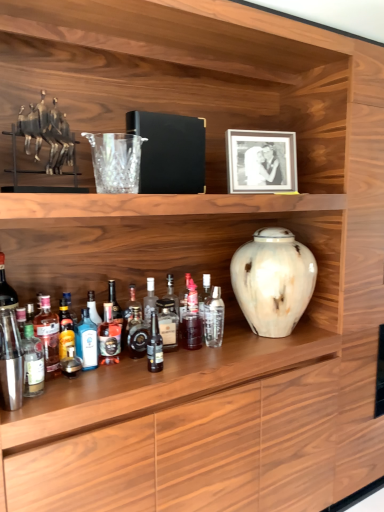
Measure the distance between point (55, 327) and camera.

A distance of 5.23 feet exists between point (55, 327) and camera.

What do you see at coordinates (33, 362) in the screenshot?
I see `translucent glass bottle at lower left, which is the ninth bottle from right to left` at bounding box center [33, 362].

What is the approximate height of translucent glass bottle at lower left, marked as the second bottle in a left-to-right arrangement?

translucent glass bottle at lower left, marked as the second bottle in a left-to-right arrangement, is 10.23 inches in height.

What do you see at coordinates (192, 320) in the screenshot? This screenshot has width=384, height=512. I see `translucent glass bottle at center, the 2th bottle positioned from the right` at bounding box center [192, 320].

Locate an element on the screen. Image resolution: width=384 pixels, height=512 pixels. clear glass bottle at center, the 10th bottle when ordered from left to right is located at coordinates (214, 318).

What do you see at coordinates (11, 361) in the screenshot?
I see `shiny metallic shaker at left, which appears as the 1th bottle when viewed from the left` at bounding box center [11, 361].

Locate an element on the screen. The image size is (384, 512). translucent glass bottle at lower left, marked as the eighth bottle in a right-to-left arrangement is located at coordinates 48,334.

Is translucent glass bottle at center, the 3th bottle in the right-to-left sequence, positioned with its back to blue glass bottle at center, which is counted as the seventh bottle, starting from the right?

No, translucent glass bottle at center, the 3th bottle in the right-to-left sequence, is not facing away from blue glass bottle at center, which is counted as the seventh bottle, starting from the right.

Is translucent glass bottle at center, the 3th bottle in the right-to-left sequence, inside the boundaries of blue glass bottle at center, which is counted as the 4th bottle, starting from the left, or outside?

translucent glass bottle at center, the 3th bottle in the right-to-left sequence, cannot be found inside blue glass bottle at center, which is counted as the 4th bottle, starting from the left.

Considering the relative sizes of translucent glass bottle at center, the 3th bottle in the right-to-left sequence, and blue glass bottle at center, which is counted as the 4th bottle, starting from the left, in the image provided, is translucent glass bottle at center, the 3th bottle in the right-to-left sequence, wider than blue glass bottle at center, which is counted as the 4th bottle, starting from the left,?

Incorrect, the width of translucent glass bottle at center, the 3th bottle in the right-to-left sequence, does not surpass that of blue glass bottle at center, which is counted as the 4th bottle, starting from the left.

How far apart are translucent glass bottle at center, which appears as the 9th bottle when viewed from the left, and blue glass bottle at center, the fifth bottle from the left?

translucent glass bottle at center, which appears as the 9th bottle when viewed from the left, is 13.58 inches away from blue glass bottle at center, the fifth bottle from the left.

Is point (183, 317) closer to viewer compared to point (113, 357)?

No, it is not.

Would you say translucent glass bottle at center, the 2th bottle positioned from the right, is outside blue glass bottle at center, the fifth bottle from the left?

Yes, translucent glass bottle at center, the 2th bottle positioned from the right, is located beyond the bounds of blue glass bottle at center, the fifth bottle from the left.

Where is `the 5th bottle below the translucent glass bottle at center, the 2th bottle positioned from the right (from the image's perspective)`? the 5th bottle below the translucent glass bottle at center, the 2th bottle positioned from the right (from the image's perspective) is located at coordinates (109, 337).

Is translucent glass bottle at lower left, which is the ninth bottle from right to left, closer to camera compared to shiny metallic shaker at left, positioned as the 10th bottle in right-to-left order?

No, translucent glass bottle at lower left, which is the ninth bottle from right to left, is behind shiny metallic shaker at left, positioned as the 10th bottle in right-to-left order.

Does point (24, 345) come behind point (5, 326)?

That is True.

Can you confirm if translucent glass bottle at lower left, which is the ninth bottle from right to left, is positioned to the left of shiny metallic shaker at left, which appears as the 1th bottle when viewed from the left?

In fact, translucent glass bottle at lower left, which is the ninth bottle from right to left, is to the right of shiny metallic shaker at left, which appears as the 1th bottle when viewed from the left.

Considering the sizes of objects translucent glass bottle at lower left, marked as the second bottle in a left-to-right arrangement, and shiny metallic shaker at left, which appears as the 1th bottle when viewed from the left, in the image provided, who is taller, translucent glass bottle at lower left, marked as the second bottle in a left-to-right arrangement, or shiny metallic shaker at left, which appears as the 1th bottle when viewed from the left,?

shiny metallic shaker at left, which appears as the 1th bottle when viewed from the left.

From a real-world perspective, is clear glass bottle at center, the 10th bottle when ordered from left to right, physically located above or below shiny metallic shaker at left, which appears as the 1th bottle when viewed from the left?

From a real-world perspective, clear glass bottle at center, the 10th bottle when ordered from left to right, is physically below shiny metallic shaker at left, which appears as the 1th bottle when viewed from the left.

Is clear glass bottle at center, the 10th bottle when ordered from left to right, aimed at shiny metallic shaker at left, positioned as the 10th bottle in right-to-left order?

No, clear glass bottle at center, the 10th bottle when ordered from left to right, is not turned towards shiny metallic shaker at left, positioned as the 10th bottle in right-to-left order.

Relative to shiny metallic shaker at left, positioned as the 10th bottle in right-to-left order, is clear glass bottle at center, which appears as the first bottle when viewed from the right, in front or behind?

clear glass bottle at center, which appears as the first bottle when viewed from the right, is positioned farther from the viewer than shiny metallic shaker at left, positioned as the 10th bottle in right-to-left order.

Which of these two, clear glass bottle at center, the 10th bottle when ordered from left to right, or shiny metallic shaker at left, which appears as the 1th bottle when viewed from the left, is bigger?

clear glass bottle at center, the 10th bottle when ordered from left to right, is bigger.

Is translucent glass bottle at center, which appears as the fourth bottle when viewed from the right, at the left side of translucent glass bottle at lower left, marked as the eighth bottle in a right-to-left arrangement?

No, translucent glass bottle at center, which appears as the fourth bottle when viewed from the right, is not to the left of translucent glass bottle at lower left, marked as the eighth bottle in a right-to-left arrangement.

Where is `the 4th bottle located above the translucent glass bottle at center, which appears as the fourth bottle when viewed from the right (from a real-world perspective)`? The image size is (384, 512). the 4th bottle located above the translucent glass bottle at center, which appears as the fourth bottle when viewed from the right (from a real-world perspective) is located at coordinates (48, 334).

How many degrees apart are the facing directions of translucent glass bottle at center, acting as the 7th bottle starting from the left, and translucent glass bottle at lower left, marked as the eighth bottle in a right-to-left arrangement?

There is a 0.0114-degree angle between the facing directions of translucent glass bottle at center, acting as the 7th bottle starting from the left, and translucent glass bottle at lower left, marked as the eighth bottle in a right-to-left arrangement.

In the scene shown: In terms of height, does translucent glass bottle at center, which appears as the fourth bottle when viewed from the right, look taller or shorter compared to translucent glass bottle at lower left, which ranks as the third bottle in left-to-right order?

In the image, translucent glass bottle at center, which appears as the fourth bottle when viewed from the right, appears to be shorter than translucent glass bottle at lower left, which ranks as the third bottle in left-to-right order.

Considering the sizes of objects matte silver picture frame at upper center and translucent glass bottle at center, which appears as the fourth bottle when viewed from the right, in the image provided, who is wider, matte silver picture frame at upper center or translucent glass bottle at center, which appears as the fourth bottle when viewed from the right,?

With larger width is matte silver picture frame at upper center.

Identify the location of picture frame above the translucent glass bottle at center, which appears as the fourth bottle when viewed from the right (from the image's perspective). The width and height of the screenshot is (384, 512). (261, 161).

Does matte silver picture frame at upper center appear on the left side of translucent glass bottle at center, acting as the 7th bottle starting from the left?

In fact, matte silver picture frame at upper center is to the right of translucent glass bottle at center, acting as the 7th bottle starting from the left.

From a real-world perspective, which is physically below, matte silver picture frame at upper center or translucent glass bottle at center, acting as the 7th bottle starting from the left?

translucent glass bottle at center, acting as the 7th bottle starting from the left, from a real-world perspective.

Starting from the blue glass bottle at center, the fifth bottle from the left, which bottle is the 1st one in front? Please provide its 2D coordinates.

[(86, 341)]

Is blue glass bottle at center, the fifth bottle from the left, not close to blue glass bottle at center, which is counted as the seventh bottle, starting from the right?

No, blue glass bottle at center, the fifth bottle from the left, is not far away from blue glass bottle at center, which is counted as the seventh bottle, starting from the right.

From a real-world perspective, is blue glass bottle at center, the fifth bottle from the left, located beneath blue glass bottle at center, which is counted as the seventh bottle, starting from the right?

No, from a real-world perspective, blue glass bottle at center, the fifth bottle from the left, is not below blue glass bottle at center, which is counted as the seventh bottle, starting from the right.

This screenshot has width=384, height=512. In order to click on bottle beneath the blue glass bottle at center, which is counted as the 4th bottle, starting from the left (from a real-world perspective) in this screenshot , I will do `click(168, 323)`.

From the translucent glass bottle at center, the 2th bottle positioned from the right, count the 4th bottle to the left and point to it. Please provide its 2D coordinates.

[(109, 337)]

Based on their spatial positions, is translucent glass bottle at center, the 2th bottle positioned from the right, or blue glass bottle at center, which is counted as the seventh bottle, starting from the right, closer to clear glass bottle at center, which appears as the first bottle when viewed from the right?

translucent glass bottle at center, the 2th bottle positioned from the right, lies closer to clear glass bottle at center, which appears as the first bottle when viewed from the right, than the other object.

From the image, which object appears to be farther from translucent glass bottle at lower left, which ranks as the third bottle in left-to-right order, white marble vase at center or shiny metallic shaker at left, positioned as the 10th bottle in right-to-left order?

Based on the image, white marble vase at center appears to be further to translucent glass bottle at lower left, which ranks as the third bottle in left-to-right order.

From the image, which object appears to be farther from translucent glass bottle at center, acting as the 7th bottle starting from the left, shiny dark brown bottle at center, which is counted as the fifth bottle, starting from the right, or clear glass bottle at center, the 10th bottle when ordered from left to right?

The object further to translucent glass bottle at center, acting as the 7th bottle starting from the left, is clear glass bottle at center, the 10th bottle when ordered from left to right.

Based on their spatial positions, is shiny metallic shaker at left, which appears as the 1th bottle when viewed from the left, or translucent glass bottle at center, positioned as the eighth bottle in left-to-right order, further from blue glass bottle at center, which is counted as the seventh bottle, starting from the right?

Based on the image, translucent glass bottle at center, positioned as the eighth bottle in left-to-right order, appears to be further to blue glass bottle at center, which is counted as the seventh bottle, starting from the right.

Which object lies nearer to the anchor point blue glass bottle at center, which is counted as the 4th bottle, starting from the left, blue glass bottle at center, the fifth bottle from the left, or translucent glass bottle at center, positioned as the eighth bottle in left-to-right order?

blue glass bottle at center, the fifth bottle from the left.

Which object lies nearer to the anchor point translucent glass bottle at center, which appears as the fourth bottle when viewed from the right, shiny dark brown bottle at center, the 6th bottle viewed from the left, or translucent glass bottle at center, the 3th bottle in the right-to-left sequence?

shiny dark brown bottle at center, the 6th bottle viewed from the left.

From the image, which object appears to be nearer to translucent glass bottle at center, which appears as the 9th bottle when viewed from the left, matte silver picture frame at upper center or translucent glass bottle at center, the 3th bottle in the right-to-left sequence?

translucent glass bottle at center, the 3th bottle in the right-to-left sequence.

Estimate the real-world distances between objects in this image. Which object is closer to translucent glass bottle at center, positioned as the eighth bottle in left-to-right order, blue glass bottle at center, which is counted as the sixth bottle, starting from the right, or white marble vase at center?

blue glass bottle at center, which is counted as the sixth bottle, starting from the right, is positioned closer to the anchor translucent glass bottle at center, positioned as the eighth bottle in left-to-right order.

Identify the location of vase between matte silver picture frame at upper center and blue glass bottle at center, which is counted as the sixth bottle, starting from the right, from top to bottom. (273, 281).

The width and height of the screenshot is (384, 512). Find the location of `bottle that lies between matte silver picture frame at upper center and clear glass bottle at center, the 10th bottle when ordered from left to right, from top to bottom`. bottle that lies between matte silver picture frame at upper center and clear glass bottle at center, the 10th bottle when ordered from left to right, from top to bottom is located at coordinates pos(192,320).

Find the location of `vase between matte silver picture frame at upper center and translucent glass bottle at center, positioned as the eighth bottle in left-to-right order, from top to bottom`. vase between matte silver picture frame at upper center and translucent glass bottle at center, positioned as the eighth bottle in left-to-right order, from top to bottom is located at coordinates (273, 281).

Where is `bottle between shiny metallic shaker at left, positioned as the 10th bottle in right-to-left order, and translucent glass bottle at lower left, marked as the eighth bottle in a right-to-left arrangement, along the z-axis`? The image size is (384, 512). bottle between shiny metallic shaker at left, positioned as the 10th bottle in right-to-left order, and translucent glass bottle at lower left, marked as the eighth bottle in a right-to-left arrangement, along the z-axis is located at coordinates [33, 362].